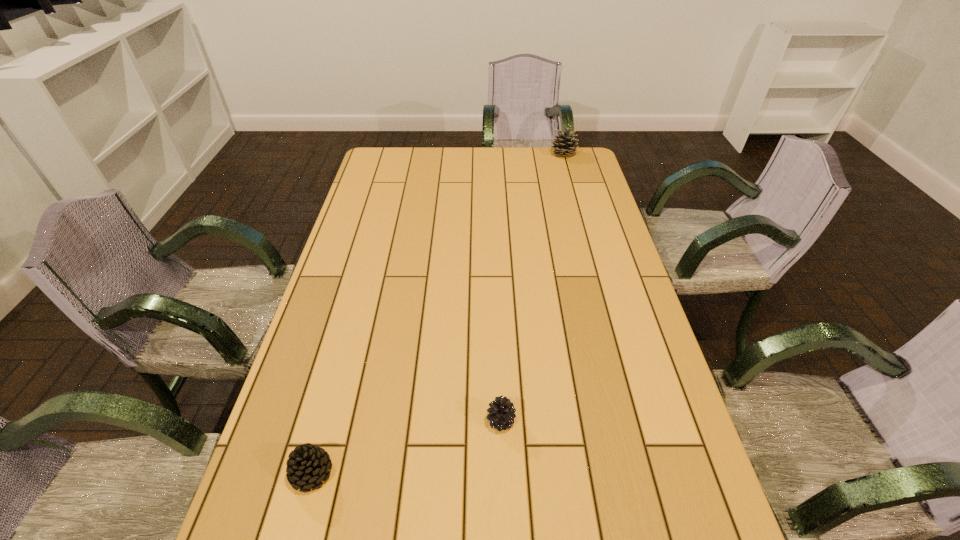
Identify the location of object present at the right edge. (564, 146).

This screenshot has width=960, height=540. Find the location of `object that is at the far right corner`. object that is at the far right corner is located at coordinates (564, 146).

At what (x,y) coordinates should I click in order to perform the action: click on free spot at the far edge of the desktop. Please return your answer as a coordinate pair (x, y). Looking at the image, I should click on (508, 160).

This screenshot has height=540, width=960. In the image, there is a desktop. In order to click on vacant space at the left edge in this screenshot , I will do `click(386, 249)`.

The height and width of the screenshot is (540, 960). In the image, there is a desktop. What are the coordinates of `vacant region at the right edge` in the screenshot? It's located at (594, 339).

The height and width of the screenshot is (540, 960). What are the coordinates of `free space at the far right corner` in the screenshot? It's located at (555, 149).

The width and height of the screenshot is (960, 540). Identify the location of unoccupied position between the leftmost object and the rightmost object. 438,314.

This screenshot has width=960, height=540. I want to click on free space between the leftmost pinecone and the tallest pinecone, so click(x=438, y=314).

You are a GUI agent. You are given a task and a screenshot of the screen. Output one action in this format:
    pyautogui.click(x=<x>, y=<y>)
    Task: Click on the empty space between the second farthest object and the farthest pinecone
    Image resolution: width=960 pixels, height=540 pixels.
    Given the screenshot: What is the action you would take?
    pyautogui.click(x=532, y=288)

Identify the location of empty space between the second object from left to right and the rightmost object. (532, 288).